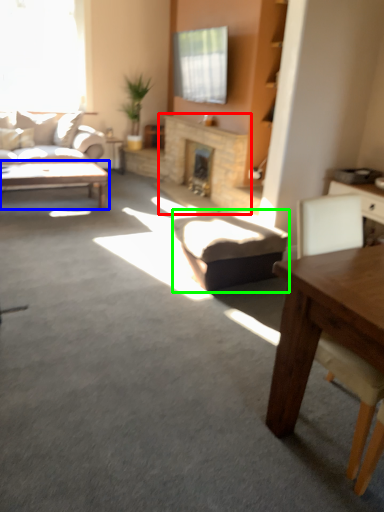
Question: Which object is the farthest from fireplace (highlighted by a red box)? Choose among these: coffee table (highlighted by a blue box) or stool (highlighted by a green box).

Choices:
 (A) coffee table
 (B) stool

Answer: (B)